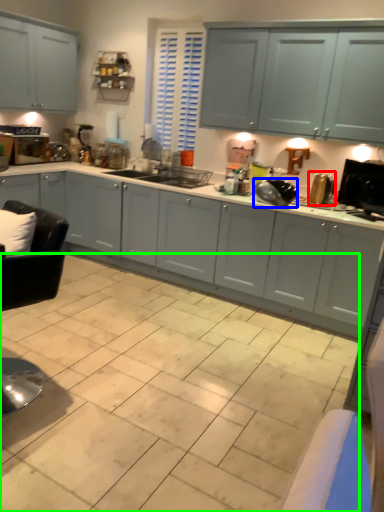
Question: Considering the real-world distances, which object is farthest from appliance (highlighted by a red box)? appliance (highlighted by a blue box) or ceramic tile (highlighted by a green box)?

Choices:
 (A) appliance
 (B) ceramic tile

Answer: (B)